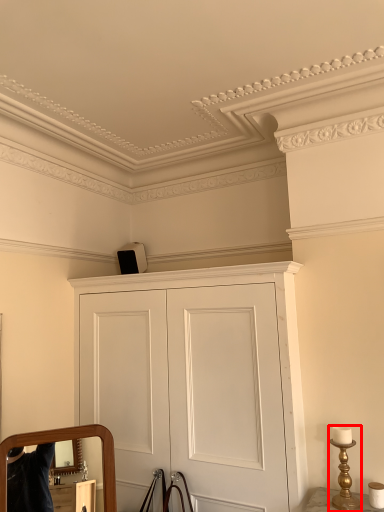
Question: Where is table lamp (annotated by the red box) located in relation to cupboard in the image?

Choices:
 (A) right
 (B) left

Answer: (A)